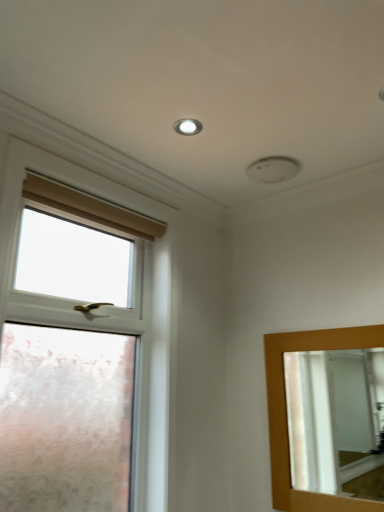
Question: Does point (362, 357) appear closer or farther from the camera than point (33, 371)?

Choices:
 (A) farther
 (B) closer

Answer: (A)

Question: Is wooden-framed mirror at right situated inside white frosted glass window at left or outside?

Choices:
 (A) outside
 (B) inside

Answer: (A)

Question: Which object is the closest to the white frosted glass window at left?

Choices:
 (A) wooden-framed mirror at right
 (B) matte white droplight at upper center

Answer: (B)

Question: Based on their relative distances, which object is nearer to the white frosted glass window at left?

Choices:
 (A) wooden-framed mirror at right
 (B) matte white droplight at upper center

Answer: (B)